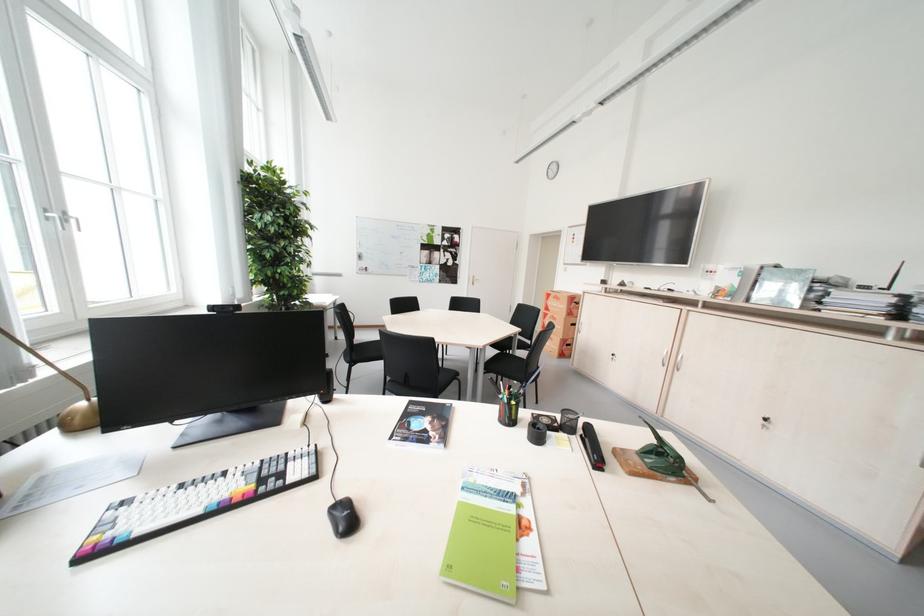
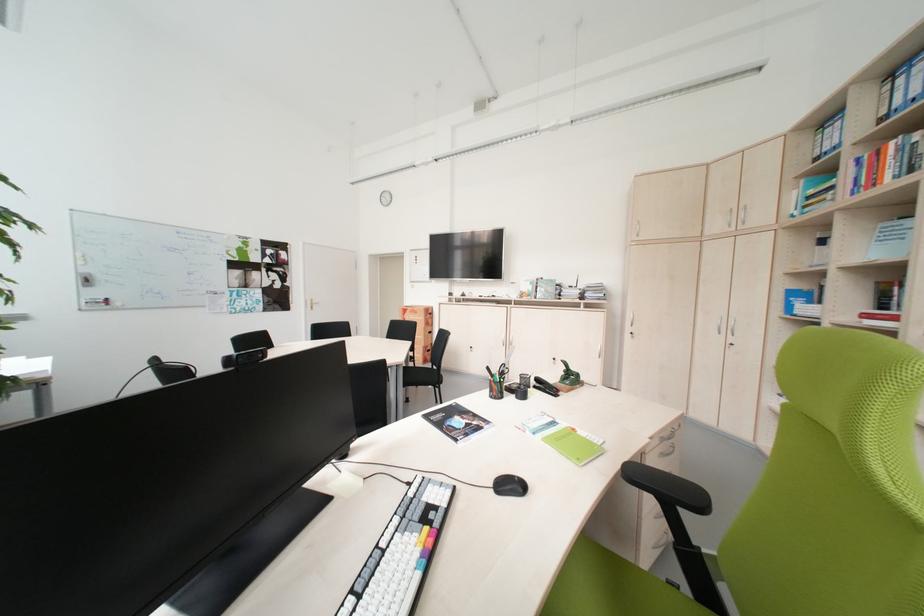
Question: The images are taken continuously from a first-person perspective. In which direction is your viewpoint rotating?

Choices:
 (A) Left
 (B) Right
 (C) Up
 (D) Down

Answer: (B)